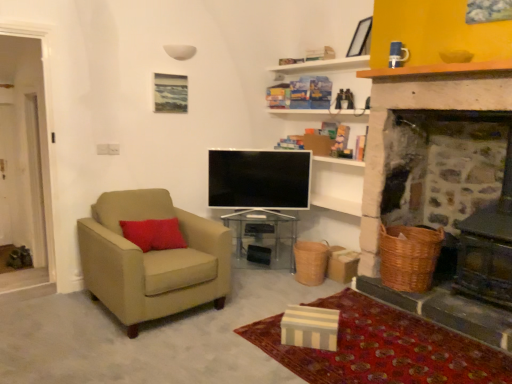
Question: Considering the relative sizes of beige fabric armchair at left and flat screen tv at center in the image provided, is beige fabric armchair at left smaller than flat screen tv at center?

Choices:
 (A) no
 (B) yes

Answer: (A)

Question: From a real-world perspective, is beige fabric armchair at left located higher than flat screen tv at center?

Choices:
 (A) yes
 (B) no

Answer: (B)

Question: From the image's perspective, is beige fabric armchair at left below flat screen tv at center?

Choices:
 (A) no
 (B) yes

Answer: (B)

Question: From the image's perspective, is beige fabric armchair at left on top of flat screen tv at center?

Choices:
 (A) no
 (B) yes

Answer: (A)

Question: Considering the relative sizes of beige fabric armchair at left and flat screen tv at center in the image provided, is beige fabric armchair at left taller than flat screen tv at center?

Choices:
 (A) yes
 (B) no

Answer: (A)

Question: From the image's perspective, is beige fabric armchair at left located above or below braided wicker basket at lower center, which is the 1th basket in left-to-right order?

Choices:
 (A) below
 (B) above

Answer: (B)

Question: Relative to braided wicker basket at lower center, which is the 1th basket in left-to-right order, is beige fabric armchair at left in front or behind?

Choices:
 (A) behind
 (B) front

Answer: (B)

Question: In terms of width, does beige fabric armchair at left look wider or thinner when compared to braided wicker basket at lower center, the 2th basket positioned from the front?

Choices:
 (A) wide
 (B) thin

Answer: (A)

Question: From a real-world perspective, relative to braided wicker basket at lower center, which is the 1th basket in left-to-right order, is beige fabric armchair at left vertically above or below?

Choices:
 (A) above
 (B) below

Answer: (A)

Question: Looking at their shapes, would you say beige fabric armchair at left is wider or thinner than transparent acrylic table at center?

Choices:
 (A) wide
 (B) thin

Answer: (A)

Question: Relative to transparent acrylic table at center, is beige fabric armchair at left in front or behind?

Choices:
 (A) front
 (B) behind

Answer: (A)

Question: Choose the correct answer: Is beige fabric armchair at left inside transparent acrylic table at center or outside it?

Choices:
 (A) outside
 (B) inside

Answer: (A)

Question: Is point (100, 254) positioned closer to the camera than point (258, 240)?

Choices:
 (A) closer
 (B) farther

Answer: (A)

Question: Would you say flat screen tv at center is inside or outside transparent acrylic table at center?

Choices:
 (A) inside
 (B) outside

Answer: (B)

Question: Is point (229, 173) positioned closer to the camera than point (248, 264)?

Choices:
 (A) farther
 (B) closer

Answer: (B)